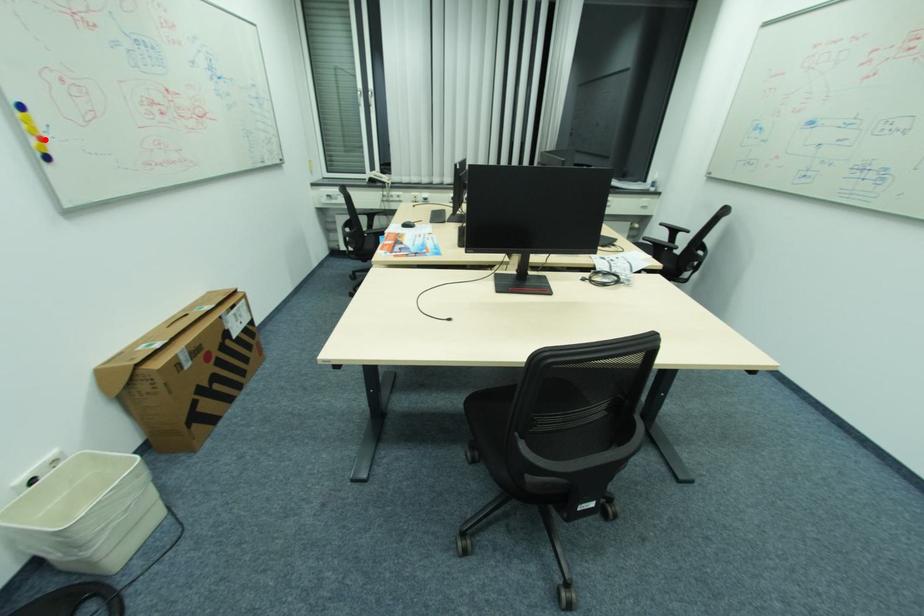
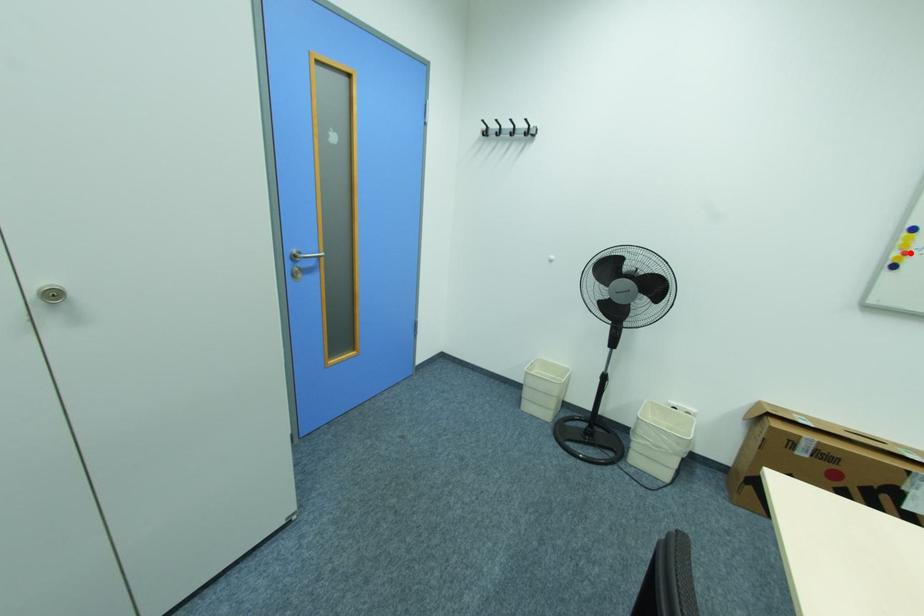
I am providing you with two images of the same scene from different viewpoints. A red point is marked on the first image and another point is marked on the second image. Do the highlighted points in image1 and image2 indicate the same real-world spot?

Yes